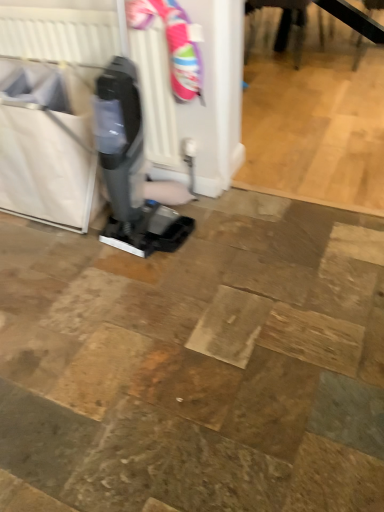
Question: Can you confirm if white plastic radiator at upper left is thinner than white fabric laundry basket at left?

Choices:
 (A) no
 (B) yes

Answer: (B)

Question: Is white plastic radiator at upper left touching white fabric laundry basket at left?

Choices:
 (A) no
 (B) yes

Answer: (A)

Question: Is white plastic radiator at upper left taller than white fabric laundry basket at left?

Choices:
 (A) yes
 (B) no

Answer: (A)

Question: From a real-world perspective, is white plastic radiator at upper left on top of white fabric laundry basket at left?

Choices:
 (A) yes
 (B) no

Answer: (A)

Question: Can you confirm if white plastic radiator at upper left is wider than white fabric laundry basket at left?

Choices:
 (A) no
 (B) yes

Answer: (A)

Question: Can you confirm if white plastic radiator at upper left is positioned to the right of white fabric laundry basket at left?

Choices:
 (A) no
 (B) yes

Answer: (B)

Question: From the image's perspective, would you say white fabric laundry basket at left is shown under white plastic radiator at upper left?

Choices:
 (A) yes
 (B) no

Answer: (A)

Question: Does white fabric laundry basket at left have a smaller size compared to white plastic radiator at upper left?

Choices:
 (A) no
 (B) yes

Answer: (A)

Question: Considering the relative sizes of white fabric laundry basket at left and white plastic radiator at upper left in the image provided, is white fabric laundry basket at left bigger than white plastic radiator at upper left?

Choices:
 (A) no
 (B) yes

Answer: (B)

Question: Would you say white plastic radiator at upper left is part of white fabric laundry basket at left's contents?

Choices:
 (A) no
 (B) yes

Answer: (B)

Question: Considering the relative positions of white fabric laundry basket at left and white plastic radiator at upper left in the image provided, is white fabric laundry basket at left to the right of white plastic radiator at upper left from the viewer's perspective?

Choices:
 (A) yes
 (B) no

Answer: (B)

Question: From a real-world perspective, is white fabric laundry basket at left located beneath white plastic radiator at upper left?

Choices:
 (A) no
 (B) yes

Answer: (B)

Question: Considering the positions of point (23, 205) and point (168, 139), is point (23, 205) closer or farther from the camera than point (168, 139)?

Choices:
 (A) farther
 (B) closer

Answer: (A)